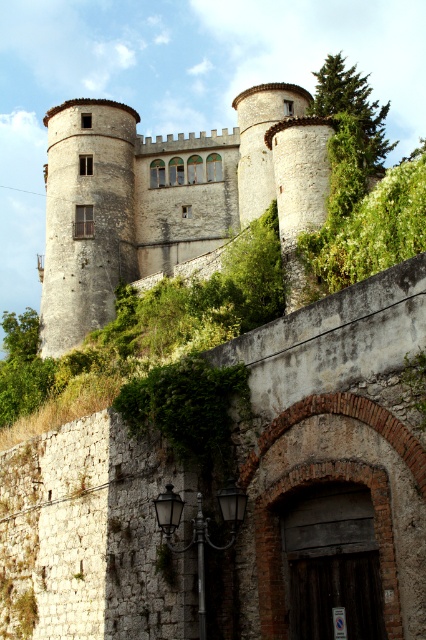
Who is higher up, white stone castle at center or green leafy bush at upper right?

Positioned higher is green leafy bush at upper right.

The width and height of the screenshot is (426, 640). In order to click on white stone castle at center in this screenshot , I will do `click(169, 198)`.